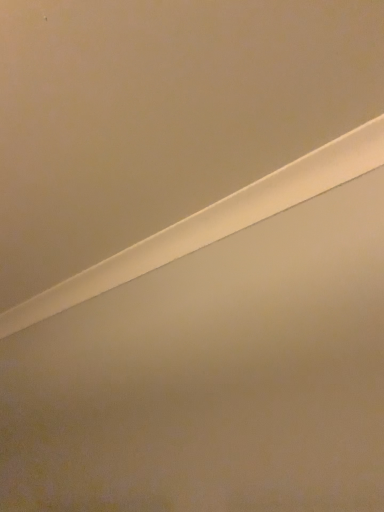
Identify the location of white smooth baseboard at lower right. (213, 222).

This screenshot has width=384, height=512. What do you see at coordinates (213, 222) in the screenshot? I see `white smooth baseboard at lower right` at bounding box center [213, 222].

Image resolution: width=384 pixels, height=512 pixels. I want to click on white smooth baseboard at lower right, so click(213, 222).